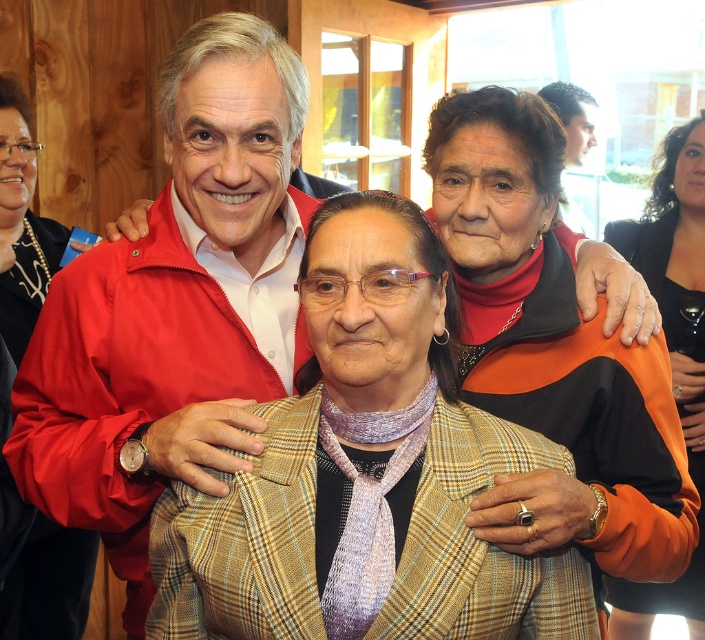
Is matte red jacket at center smaller than black matte jacket at upper left?

No.

Which is more to the left, matte red jacket at center or black matte jacket at upper left?

Positioned to the left is black matte jacket at upper left.

The height and width of the screenshot is (640, 705). I want to click on matte red jacket at center, so click(x=173, y=298).

Can you confirm if matte red jacket at center is smaller than orange fabric jacket at upper right?

Yes.

Is matte red jacket at center to the left of orange fabric jacket at upper right from the viewer's perspective?

Indeed, matte red jacket at center is positioned on the left side of orange fabric jacket at upper right.

Identify the location of matte red jacket at center. This screenshot has height=640, width=705. (173, 298).

The height and width of the screenshot is (640, 705). What do you see at coordinates (673, 353) in the screenshot?
I see `orange fabric jacket at upper right` at bounding box center [673, 353].

Does orange fabric jacket at upper right appear on the left side of black matte jacket at upper left?

In fact, orange fabric jacket at upper right is to the right of black matte jacket at upper left.

Which is in front, point (689, 358) or point (36, 589)?

Point (36, 589) is in front.

Where is `orange fabric jacket at upper right`? This screenshot has height=640, width=705. orange fabric jacket at upper right is located at coordinates (673, 353).